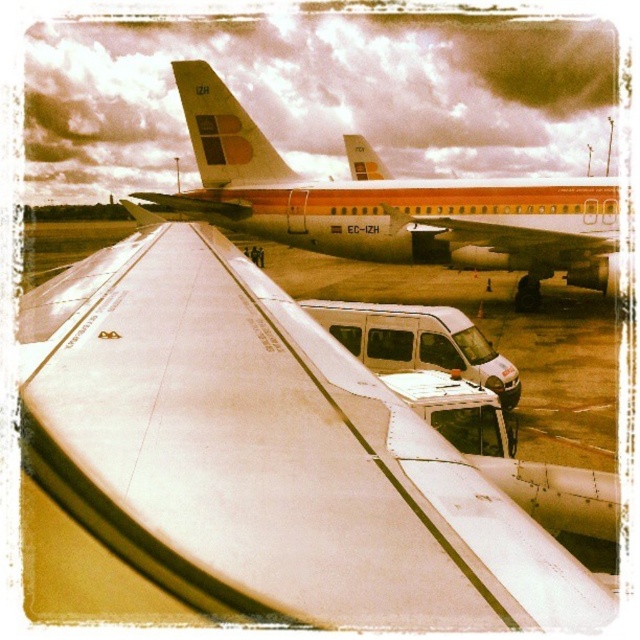
Is the position of orange matte airliner at upper center less distant than that of matte orange airplane wing at center?

Yes, it is.

Is point (248, 132) positioned after point (461, 241)?

Yes, point (248, 132) is behind point (461, 241).

Is point (182, 77) behind point (595, 252)?

Yes, point (182, 77) is behind point (595, 252).

Identify the location of orange matte airliner at upper center. (390, 204).

Based on the photo, can you confirm if orange matte airliner at upper center is shorter than matte yellow tail at upper center?

No.

Is point (372, 240) closer to camera compared to point (211, 83)?

That is True.

Identify the location of orange matte airliner at upper center. The height and width of the screenshot is (640, 640). (390, 204).

Can you confirm if matte yellow tail at upper center is shorter than matte orange airplane wing at center?

Incorrect, matte yellow tail at upper center's height does not fall short of matte orange airplane wing at center's.

Can you confirm if matte yellow tail at upper center is smaller than matte orange airplane wing at center?

No, matte yellow tail at upper center is not smaller than matte orange airplane wing at center.

Who is more forward, (196, 65) or (461, 240)?

Point (461, 240)

Where is `matte yellow tail at upper center`? The width and height of the screenshot is (640, 640). matte yellow tail at upper center is located at coordinates (225, 131).